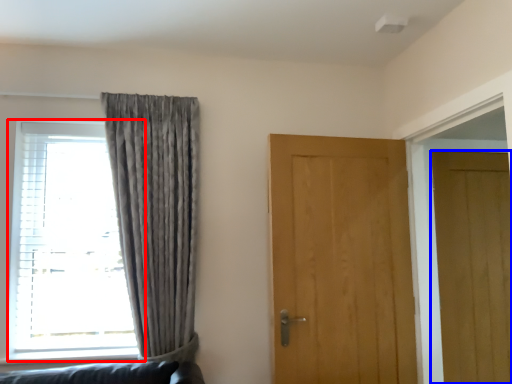
Question: Which point is further to the camera, window (highlighted by a red box) or door (highlighted by a blue box)?

Choices:
 (A) window
 (B) door

Answer: (B)